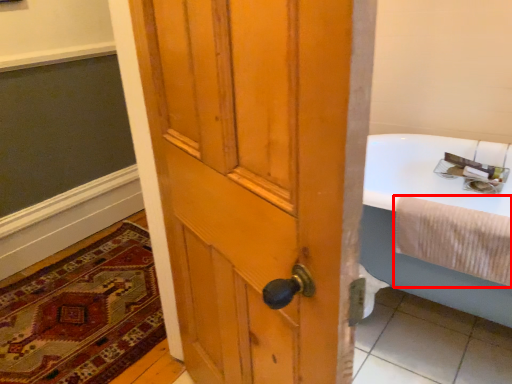
Question: In this image, where is bath towel (annotated by the red box) located relative to mat?

Choices:
 (A) right
 (B) left

Answer: (A)